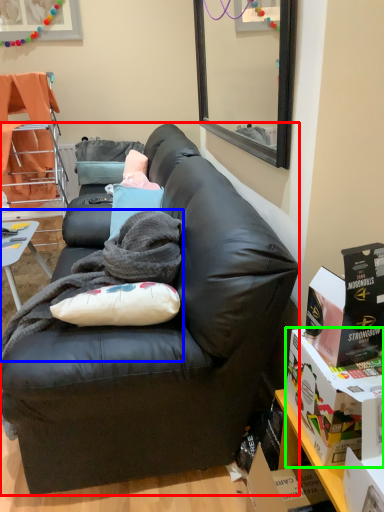
Question: Which object is the farthest from studio couch (highlighted by a red box)? Choose among these: blanket (highlighted by a blue box) or box (highlighted by a green box).

Choices:
 (A) blanket
 (B) box

Answer: (B)